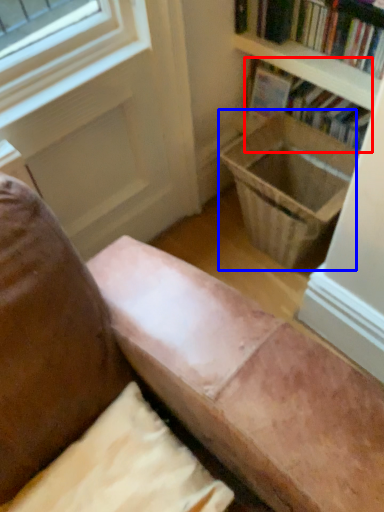
Question: Which object appears farthest to the camera in this image, book (highlighted by a red box) or laundry basket (highlighted by a blue box)?

Choices:
 (A) book
 (B) laundry basket

Answer: (A)